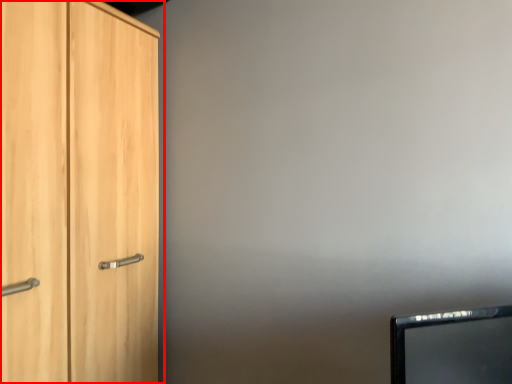
Question: From the image's perspective, what is the correct spatial positioning of cupboard (annotated by the red box) in reference to computer monitor?

Choices:
 (A) below
 (B) above

Answer: (B)